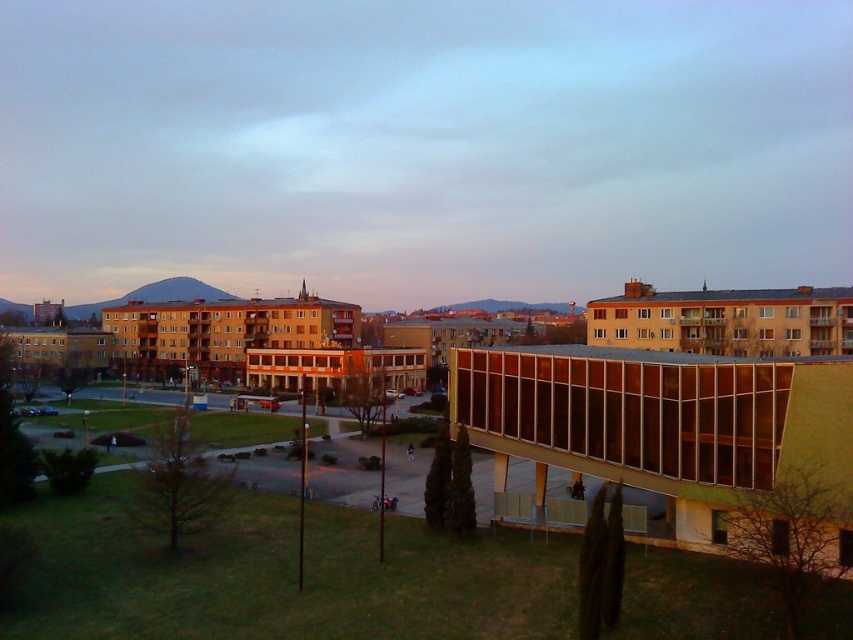
You are standing on the walkway leading to the matte orange building at center and the translucent glass building at center. Which building is closer to your right side?

The translucent glass building at center is closer to your right side because the matte orange building at center is positioned to its left.

You are standing at point [508,349] and want to walk to point [148,280]. Based on the scene description, will you be moving towards the building or away from it?

Since point [148,280] is behind point [508,349], you will be moving towards the building as you walk from point [508,349] to point [148,280].

You are standing at the entrance of the matte orange building at center. Looking towards the grassy area, which direction should you walk to reach the grassy area?

The matte orange building at center is located at point (422, 145). Since the walkway extends from the building towards the grassy area, you should walk in the direction of the walkway to reach the grassy area.